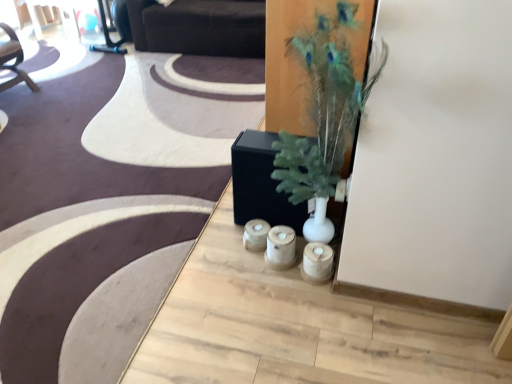
Question: Is wooden candle holders at center thinner than dark brown leather couch at upper center?

Choices:
 (A) no
 (B) yes

Answer: (B)

Question: Is wooden candle holders at center completely or partially outside of dark brown leather couch at upper center?

Choices:
 (A) no
 (B) yes

Answer: (B)

Question: From the image's perspective, does wooden candle holders at center appear higher than dark brown leather couch at upper center?

Choices:
 (A) yes
 (B) no

Answer: (B)

Question: Does wooden candle holders at center have a larger size compared to dark brown leather couch at upper center?

Choices:
 (A) no
 (B) yes

Answer: (A)

Question: Does wooden candle holders at center have a smaller size compared to dark brown leather couch at upper center?

Choices:
 (A) no
 (B) yes

Answer: (B)

Question: Considering their positions, is wooden candle holders at center located in front of or behind green feathered plant at center?

Choices:
 (A) behind
 (B) front

Answer: (A)

Question: Considering the positions of wooden candle holders at center and green feathered plant at center in the image, is wooden candle holders at center wider or thinner than green feathered plant at center?

Choices:
 (A) thin
 (B) wide

Answer: (A)

Question: Considering the relative positions of wooden candle holders at center and green feathered plant at center in the image provided, is wooden candle holders at center to the left or to the right of green feathered plant at center?

Choices:
 (A) right
 (B) left

Answer: (B)

Question: From their relative heights in the image, would you say wooden candle holders at center is taller or shorter than green feathered plant at center?

Choices:
 (A) short
 (B) tall

Answer: (A)

Question: From a real-world perspective, is green feathered plant at center above or below wooden candle holders at center?

Choices:
 (A) below
 (B) above

Answer: (B)

Question: Is green feathered plant at center bigger or smaller than wooden candle holders at center?

Choices:
 (A) big
 (B) small

Answer: (A)

Question: From the image's perspective, is green feathered plant at center positioned above or below wooden candle holders at center?

Choices:
 (A) above
 (B) below

Answer: (A)

Question: Considering the positions of green feathered plant at center and wooden candle holders at center in the image, is green feathered plant at center taller or shorter than wooden candle holders at center?

Choices:
 (A) tall
 (B) short

Answer: (A)

Question: Is green feathered plant at center to the left or to the right of dark brown leather couch at upper center in the image?

Choices:
 (A) right
 (B) left

Answer: (A)

Question: From a real-world perspective, is green feathered plant at center physically located above or below dark brown leather couch at upper center?

Choices:
 (A) below
 (B) above

Answer: (B)